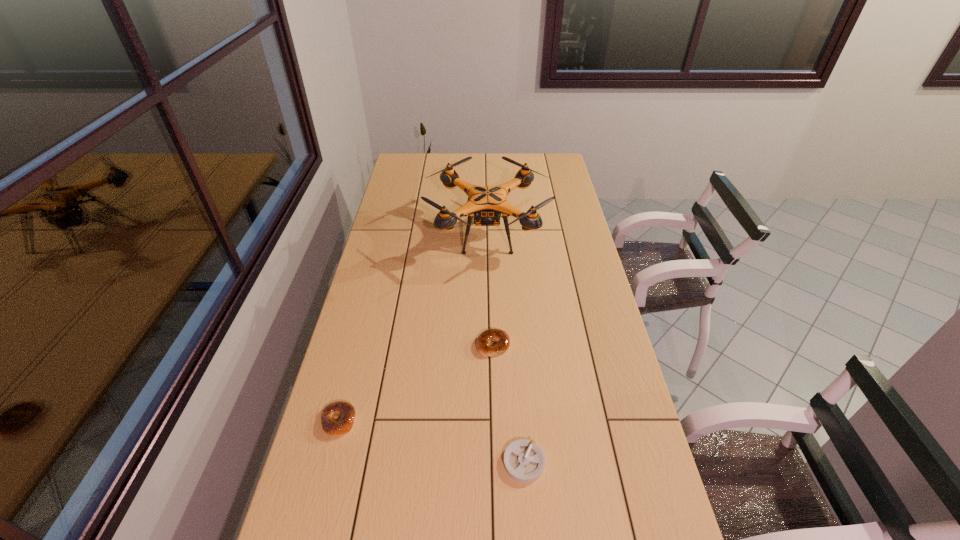
At what (x,y) coordinates should I click in order to perform the action: click on drone. Please return your answer as a coordinate pair (x, y). The height and width of the screenshot is (540, 960). Looking at the image, I should click on (487, 203).

At what (x,y) coordinates should I click in order to perform the action: click on the farthest object. Please return your answer as a coordinate pair (x, y). Looking at the image, I should click on (487, 203).

Locate an element on the screen. This screenshot has width=960, height=540. the farther bagel is located at coordinates (488, 336).

Locate an element on the screen. the right bagel is located at coordinates (488, 336).

Find the location of `the nearer bagel`. the nearer bagel is located at coordinates pyautogui.click(x=346, y=411).

Find the location of `the second nearest object`. the second nearest object is located at coordinates (346, 411).

Image resolution: width=960 pixels, height=540 pixels. Identify the location of ashtray. (524, 461).

Identify the location of free space located on the camera mount of the tallest object. click(x=394, y=233).

Locate an element on the screen. The image size is (960, 540). free space located 0.150m on the camera mount of the tallest object is located at coordinates (392, 233).

Where is `vacant space located 0.110m on the camera mount of the tallest object`? The height and width of the screenshot is (540, 960). vacant space located 0.110m on the camera mount of the tallest object is located at coordinates (401, 233).